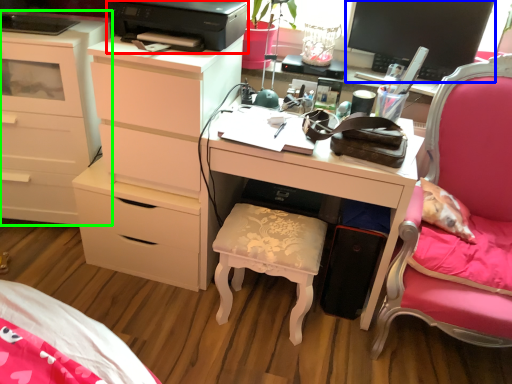
Question: Which object is positioned closest to printer (highlighted by a red box)? Select from computer monitor (highlighted by a blue box) and chest of drawers (highlighted by a green box).

Choices:
 (A) computer monitor
 (B) chest of drawers

Answer: (B)